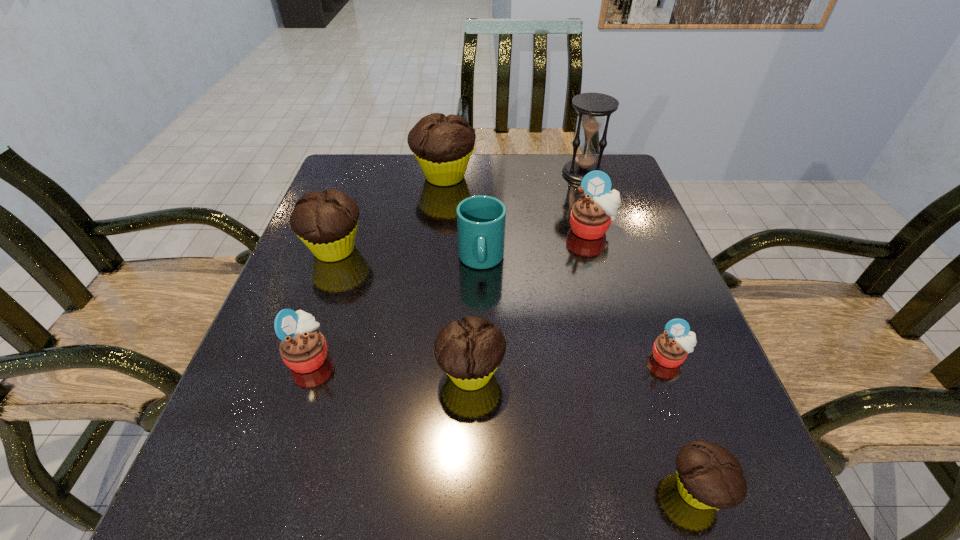
In order to click on free location located 0.170m on the front-facing side of the smallest pink muffin in this screenshot , I will do `click(710, 467)`.

The height and width of the screenshot is (540, 960). Find the location of `free space located on the left of the rightmost chocolate muffin`. free space located on the left of the rightmost chocolate muffin is located at coordinates (590, 490).

Locate an element on the screen. Image resolution: width=960 pixels, height=540 pixels. hourglass situated at the far edge is located at coordinates (592, 107).

The height and width of the screenshot is (540, 960). I want to click on muffin at the far edge, so pyautogui.click(x=443, y=145).

I want to click on object that is at the near edge, so click(708, 476).

Find the location of a particular element. Image resolution: width=960 pixels, height=540 pixels. hourglass positioned at the right edge is located at coordinates 592,107.

Identify the location of object present at the far right corner. (592, 107).

This screenshot has height=540, width=960. Find the location of `object that is at the near right corner`. object that is at the near right corner is located at coordinates (708, 476).

Locate an element on the screen. This screenshot has width=960, height=540. vacant space at the far edge of the desktop is located at coordinates (547, 185).

Identify the location of free space at the near edge of the desktop. The height and width of the screenshot is (540, 960). (576, 492).